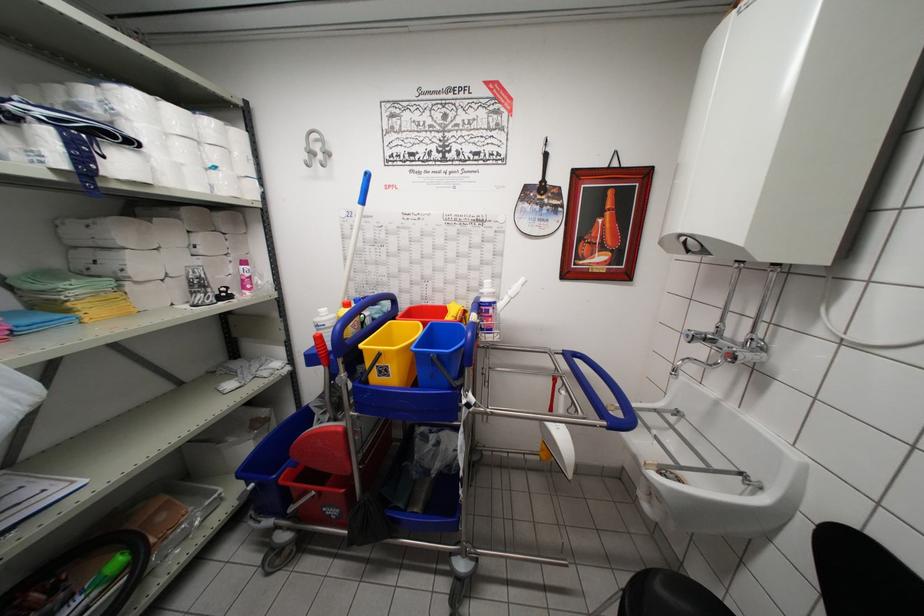
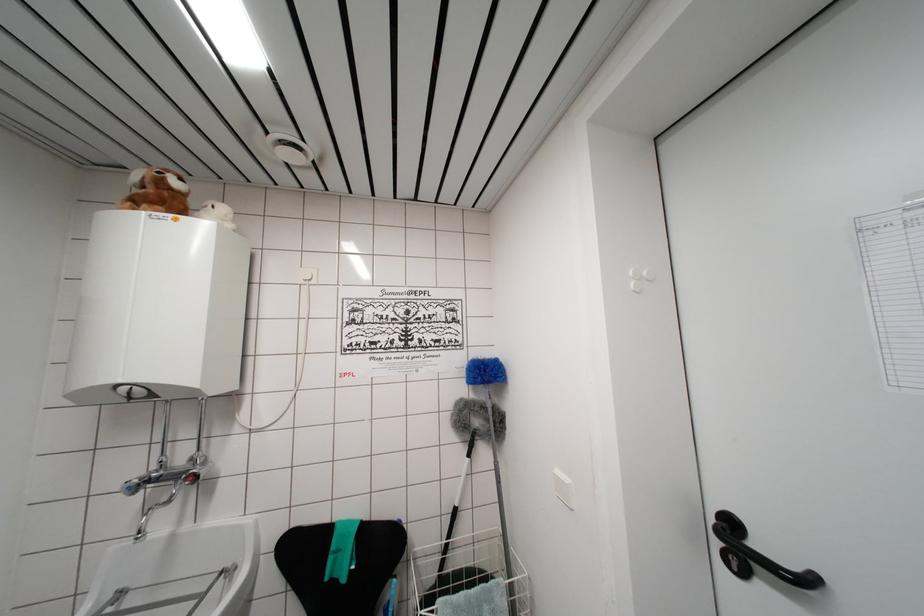
In the second image, find the point that corresponds to (x=737, y=354) in the first image.

(197, 476)